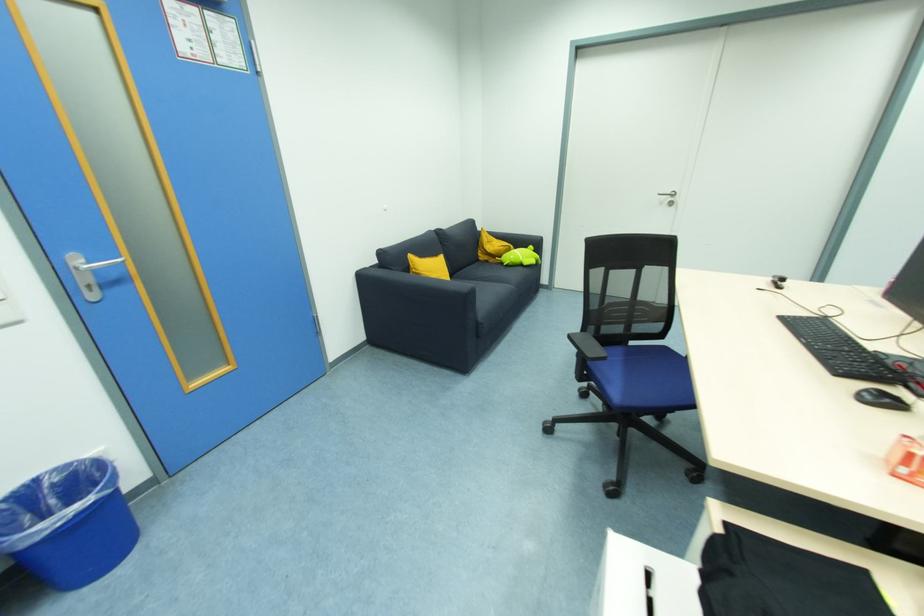
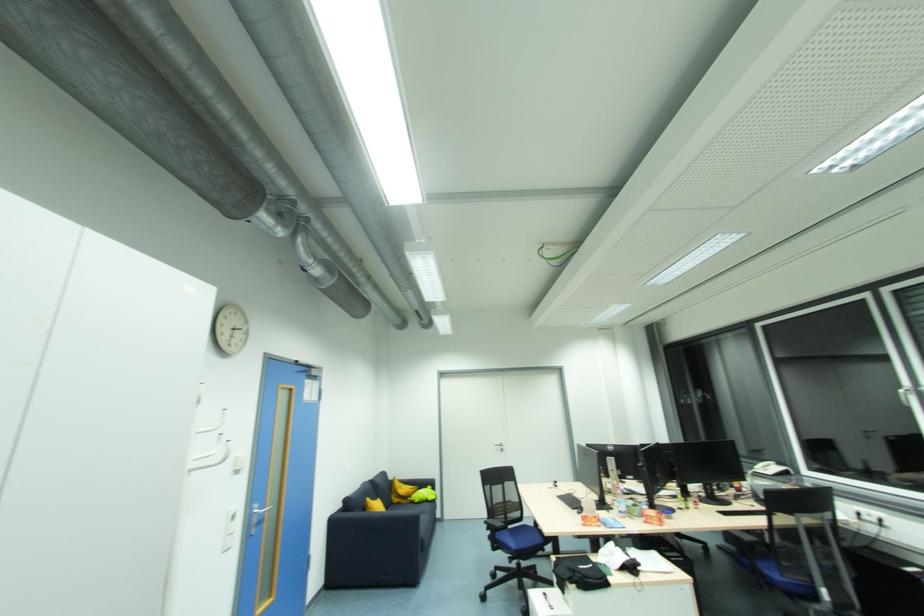
In the second image, find the point that corresponds to point 489,262 in the first image.

(400, 505)